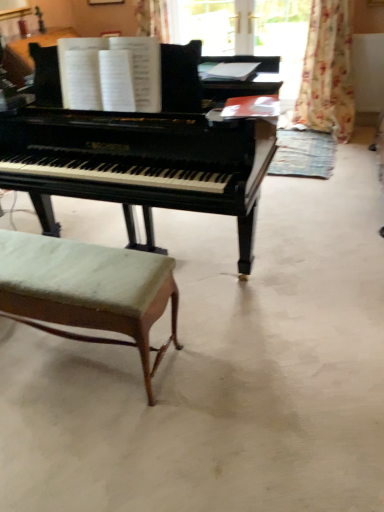
Where is `empty space that is to the right of black polished piano at center`? This screenshot has width=384, height=512. empty space that is to the right of black polished piano at center is located at coordinates (334, 213).